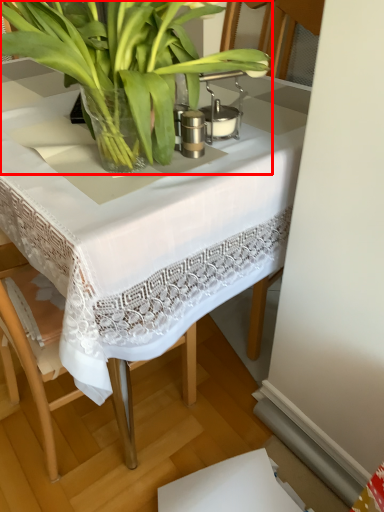
Question: From the image's perspective, considering the relative positions of houseplant (annotated by the red box) and table in the image provided, where is houseplant (annotated by the red box) located with respect to the staircase?

Choices:
 (A) above
 (B) below

Answer: (A)